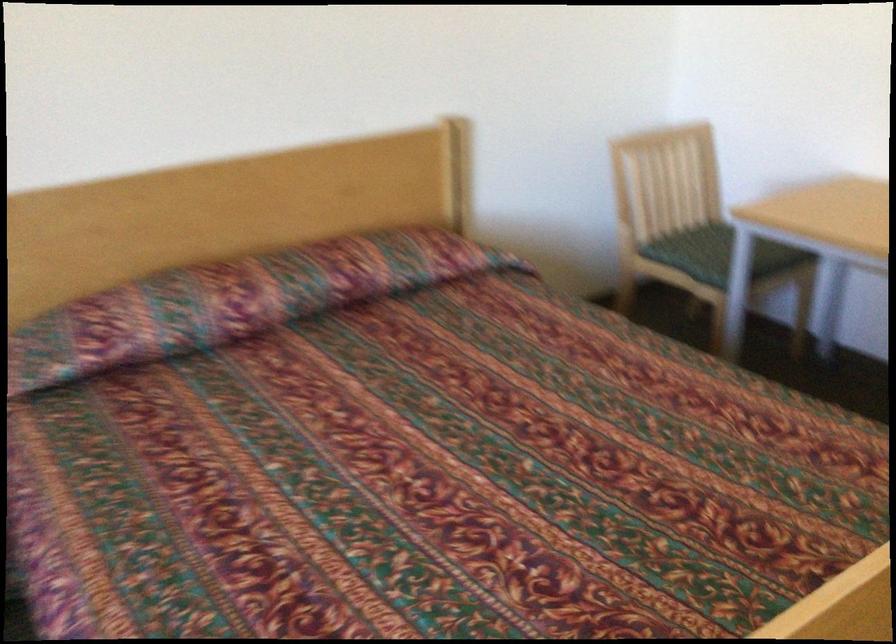
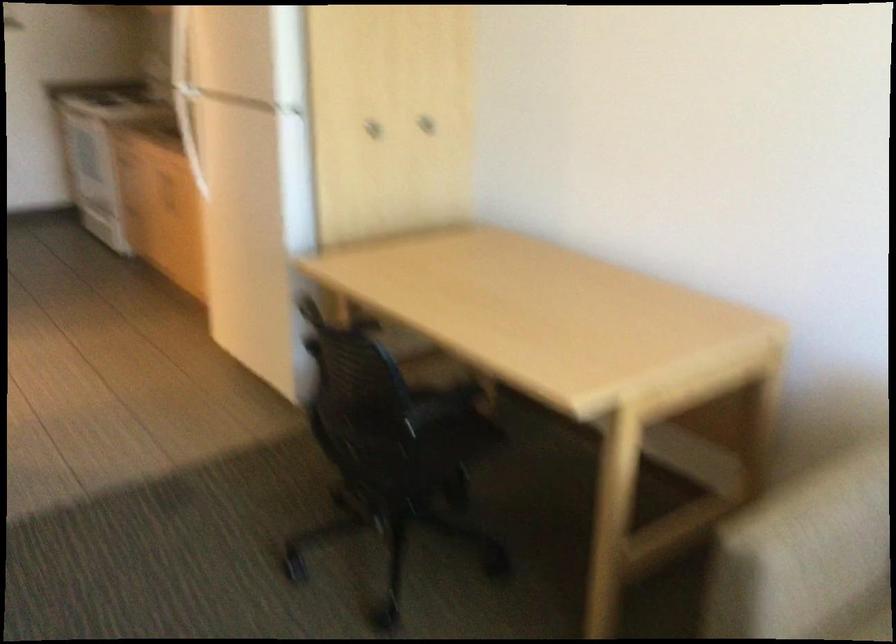
The images are taken continuously from a first-person perspective. In which direction is your viewpoint rotating?

The camera rotated toward right-down.